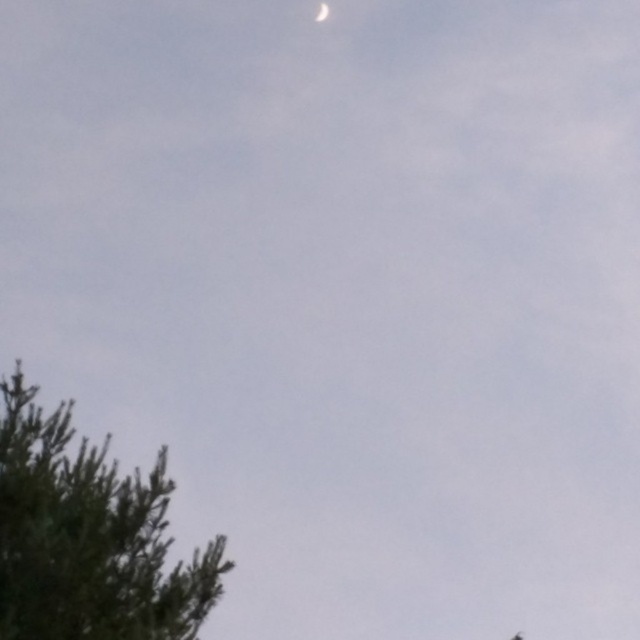
You are standing in the field looking at the green textured tree at lower left and the white glossy moon at upper center. Which object appears larger in the scene?

The green textured tree at lower left appears larger because it is closer to the viewer than the white glossy moon at upper center.

You are an astronomer observing the sky and notice the green textured tree at lower left and the white glossy moon at upper center. Which object appears bigger in the image?

The green textured tree at lower left appears larger in size than the white glossy moon at upper center according to the description.